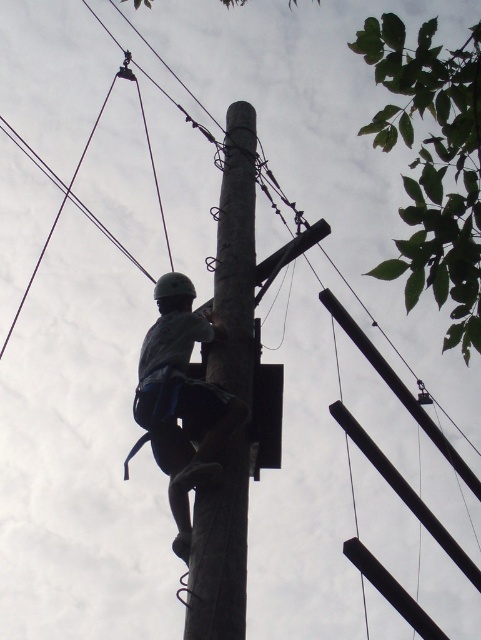
Does smooth wooden pole at center have a lesser width compared to matte black helmet at center?

Incorrect, smooth wooden pole at center's width is not less than matte black helmet at center's.

Does smooth wooden pole at center lie behind matte black helmet at center?

No.

Find the location of a particular element. The width and height of the screenshot is (481, 640). smooth wooden pole at center is located at coordinates (236, 257).

Which of these two, smooth wooden pole at center or dark gray fabric climbing harness at center, stands shorter?

With less height is dark gray fabric climbing harness at center.

Image resolution: width=481 pixels, height=640 pixels. Describe the element at coordinates (236, 257) in the screenshot. I see `smooth wooden pole at center` at that location.

This screenshot has height=640, width=481. I want to click on smooth wooden pole at center, so click(236, 257).

The width and height of the screenshot is (481, 640). What are the coordinates of `smooth wooden pole at center` in the screenshot? It's located at (236, 257).

Is dark gray fabric climbing harness at center to the right of matte black helmet at center from the viewer's perspective?

Yes, dark gray fabric climbing harness at center is to the right of matte black helmet at center.

Does dark gray fabric climbing harness at center have a greater width compared to matte black helmet at center?

No, dark gray fabric climbing harness at center is not wider than matte black helmet at center.

What do you see at coordinates (180, 401) in the screenshot? The image size is (481, 640). I see `dark gray fabric climbing harness at center` at bounding box center [180, 401].

Find the location of a particular element. Image resolution: width=481 pixels, height=640 pixels. dark gray fabric climbing harness at center is located at coordinates (180, 401).